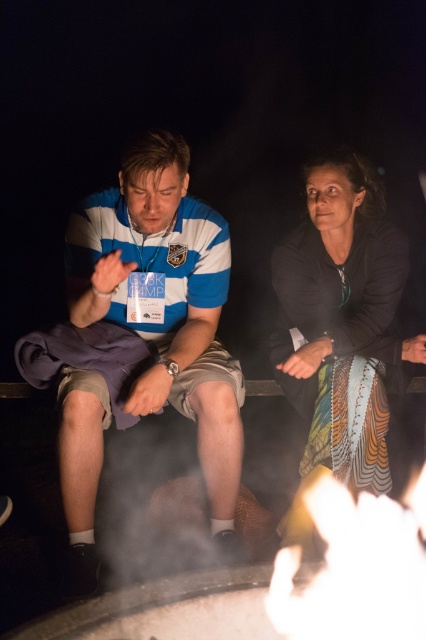
Which is below, striped polo shirt at left or black matte dress at center?

striped polo shirt at left is below.

Between striped polo shirt at left and black matte dress at center, which one appears on the right side from the viewer's perspective?

black matte dress at center

Identify the location of striped polo shirt at left. Image resolution: width=426 pixels, height=640 pixels. (164, 304).